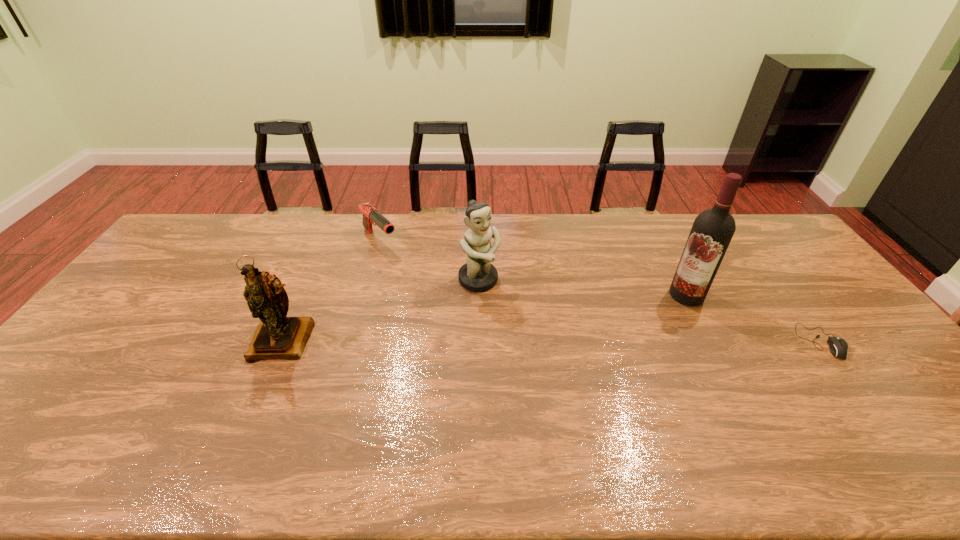
Identify the location of free spot that satisfies the following two spatial constraints: 1. on the front side of the right figurine; 2. on the left side of the fourth object from left to right. (479, 295).

Where is `vacant region that satisfies the following two spatial constraints: 1. on the front side of the gun; 2. on the left side of the computer mouse`? The image size is (960, 540). vacant region that satisfies the following two spatial constraints: 1. on the front side of the gun; 2. on the left side of the computer mouse is located at coordinates (351, 341).